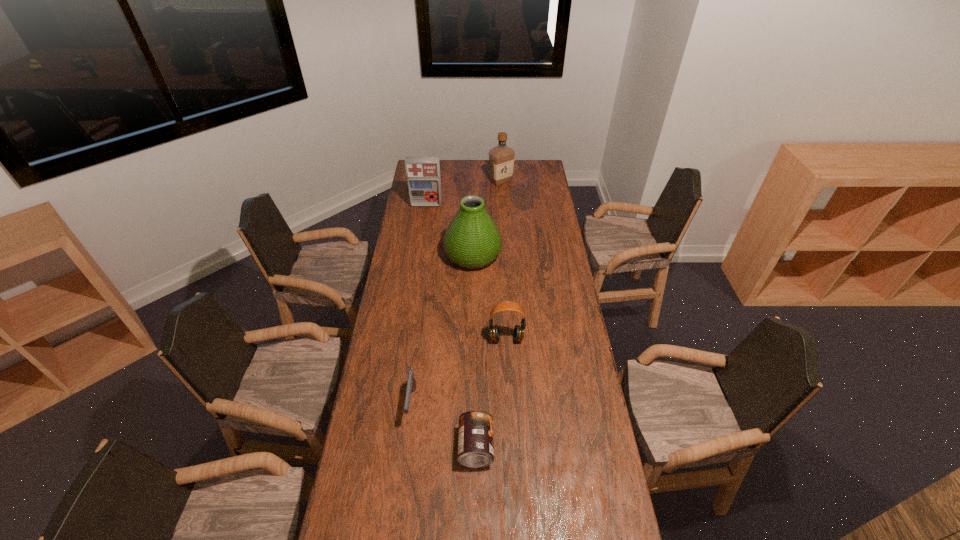
The image size is (960, 540). Identify the location of the third farthest object. (472, 240).

In order to click on liquor in this screenshot , I will do `click(501, 157)`.

The width and height of the screenshot is (960, 540). Find the location of `the second farthest object`. the second farthest object is located at coordinates (423, 173).

Find the location of a particular element. the third nearest object is located at coordinates (518, 334).

Image resolution: width=960 pixels, height=540 pixels. I want to click on the fourth tallest object, so pos(518,334).

Find the location of `pistol`. pistol is located at coordinates (411, 382).

The height and width of the screenshot is (540, 960). What are the coordinates of `the nearest object` in the screenshot? It's located at tap(475, 438).

The width and height of the screenshot is (960, 540). In order to click on vacant space located 0.050m on the left of the fourth nearest object in this screenshot , I will do `click(434, 255)`.

Identify the location of free space located on the front-facing side of the liquor. (504, 230).

Locate an element on the screen. The image size is (960, 540). blank space located 0.230m on the front-facing side of the first-aid kit is located at coordinates (421, 234).